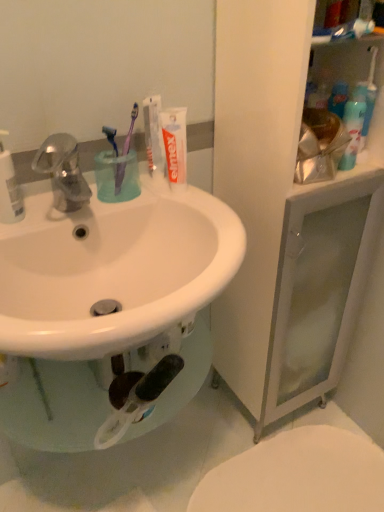
Identify the location of free space that is to the left of white glossy toilet at lower right. pyautogui.click(x=146, y=463).